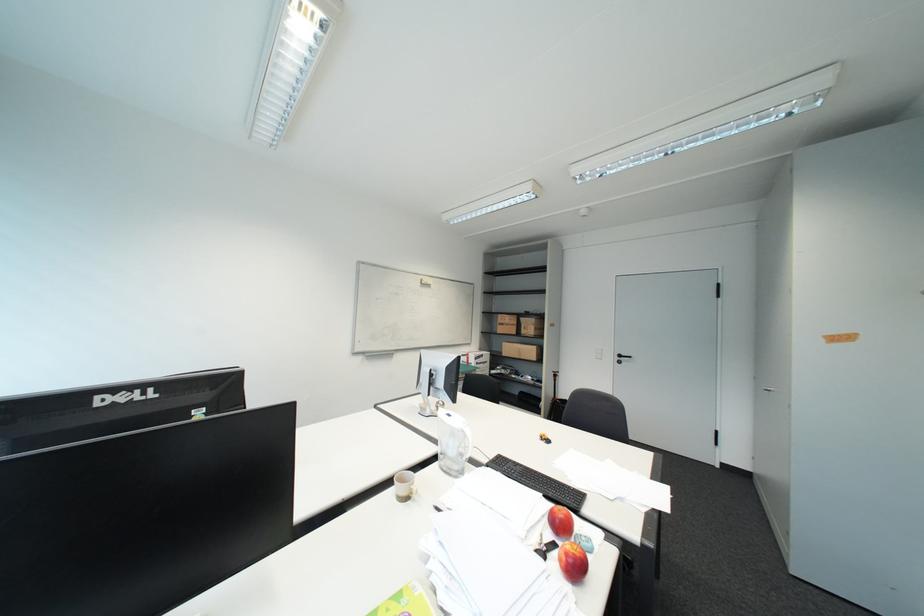
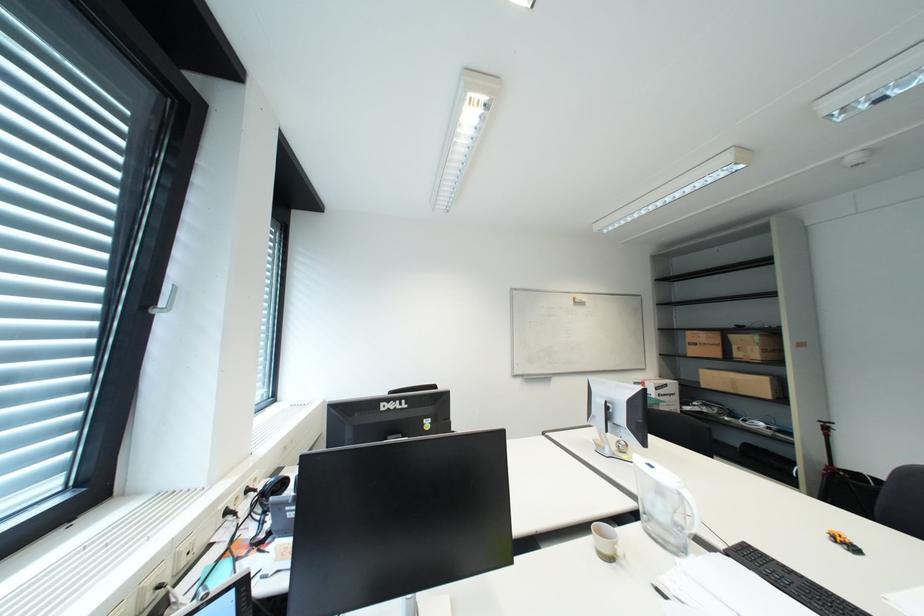
Question: The images are taken continuously from a first-person perspective. In which direction is your viewpoint rotating?

Choices:
 (A) Left
 (B) Right
 (C) Up
 (D) Down

Answer: (A)